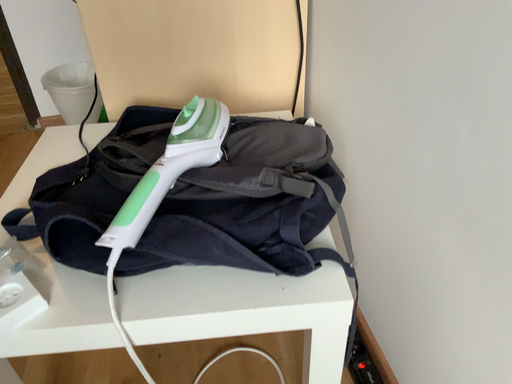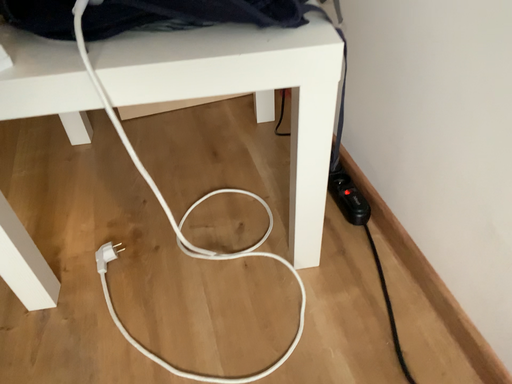
Question: Which way did the camera rotate in the video?

Choices:
 (A) rotated upward
 (B) rotated downward

Answer: (B)